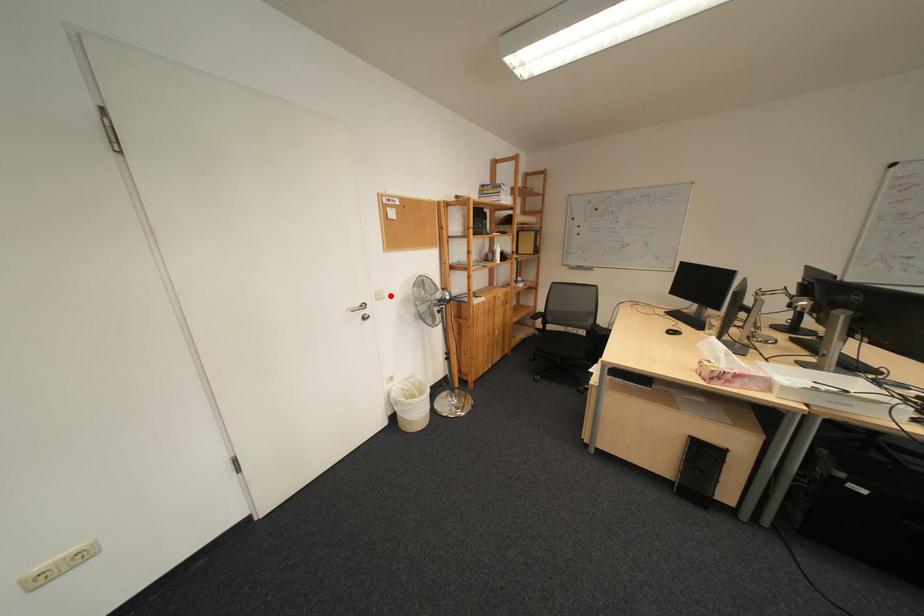
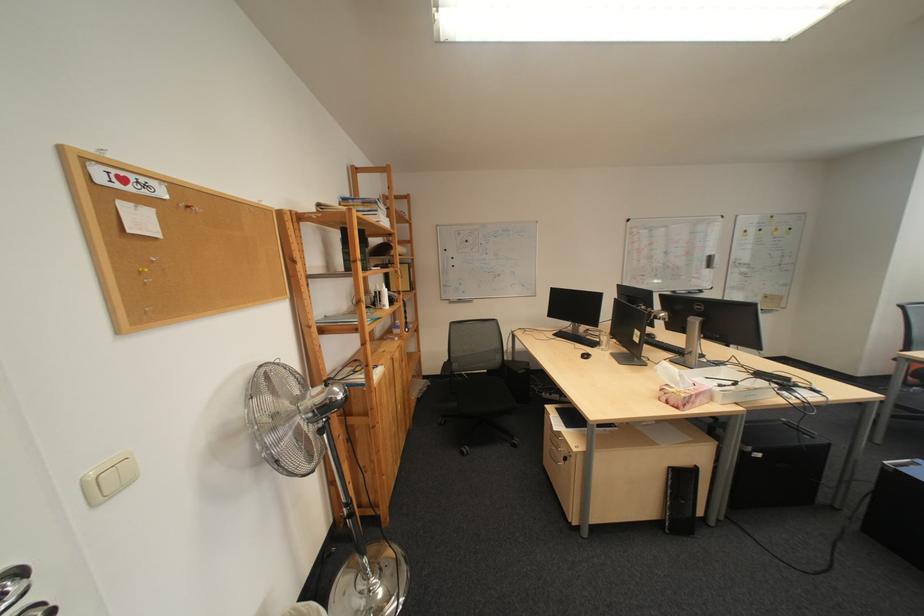
The point at the highlighted location is marked in the first image. Where is the corresponding point in the second image?

(107, 488)